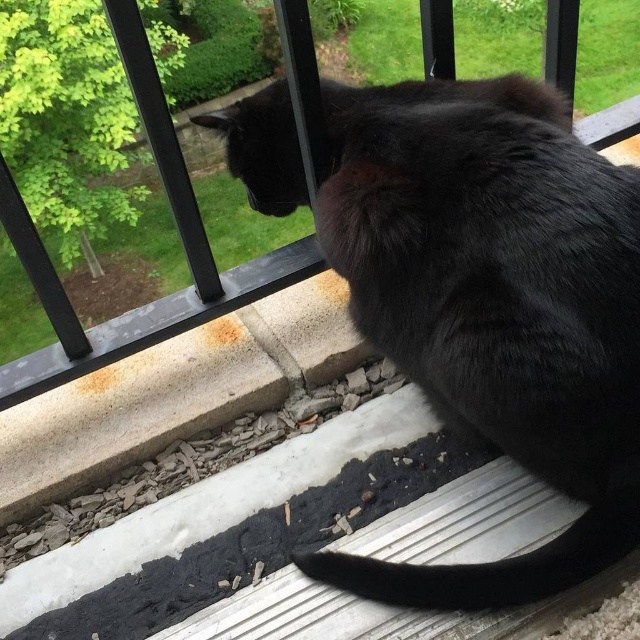
You are a small toy that is 10 cm tall. You are placed on the ground near the black fluffy cat at upper center and the transparent plastic screen door at upper center. Can you see both objects from your position?

The black fluffy cat at upper center is taller than the transparent plastic screen door at upper center, so the cat will block your view of the transparent plastic screen door at upper center.

You are standing on the balcony and want to place a small treat exactly at the point marked by the coordinates point (x=492, y=307). Which object from the scene will this treat land on?

The treat will land on the black fluffy cat at upper center because the point (x=492, y=307) is located on that object.